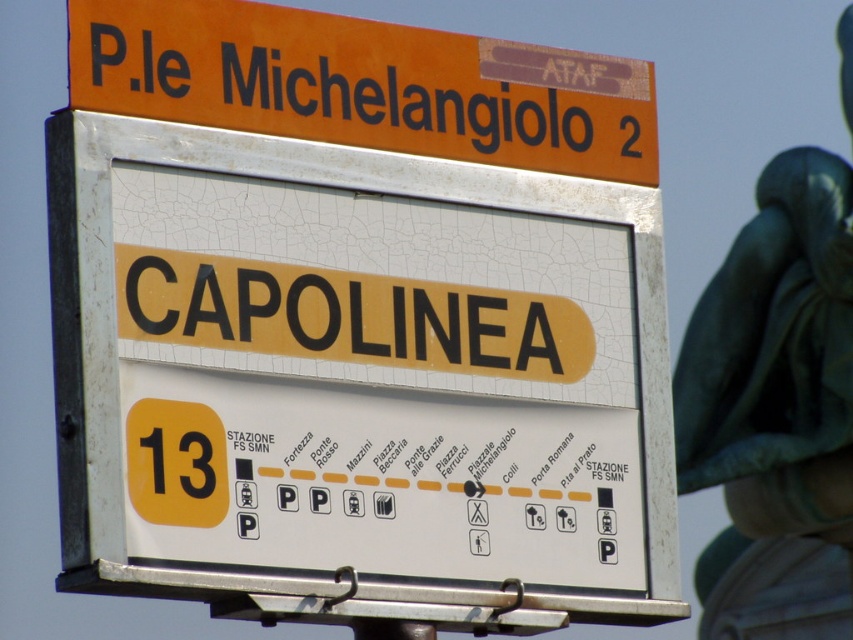
Which of these two, white cracked plastic sign at center or orange matte sign at upper center, stands taller?

white cracked plastic sign at center is taller.

Who is lower down, white cracked plastic sign at center or orange matte sign at upper center?

white cracked plastic sign at center is lower down.

Where is `white cracked plastic sign at center`? This screenshot has height=640, width=853. white cracked plastic sign at center is located at coordinates click(357, 380).

You are a GUI agent. You are given a task and a screenshot of the screen. Output one action in this format:
    pyautogui.click(x=<x>, y=<y>)
    Task: Click on the white cracked plastic sign at center
    The width and height of the screenshot is (853, 640).
    Given the screenshot: What is the action you would take?
    pyautogui.click(x=357, y=380)